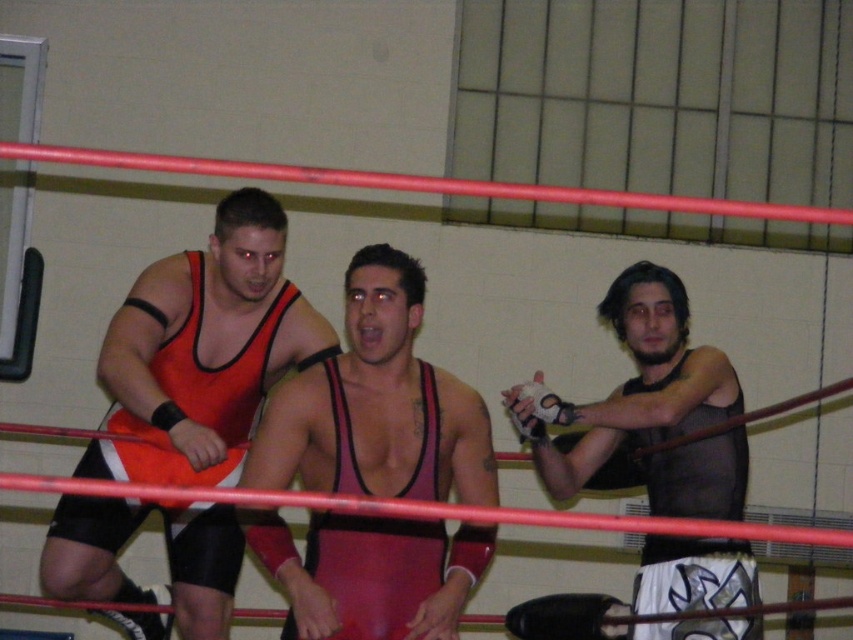
Based on the scene description, which wrestler is closer to the viewer? Please consider the positions of the shiny red singlet at center and the black mesh tank top at right.

The shiny red singlet at center is closer to the viewer as it is positioned in front of the black mesh tank top at right.

Based on the scene description, where is the matte orange singlet at center located in terms of its 2D coordinates?

The matte orange singlet at center is located at the 2D coordinates of point (202, 349).

You are a referee in a wrestling match and need to ensure the wrestlers are within the safety zone. The safety zone requires that wrestlers must be at least 20 inches apart. Are the matte orange singlet at center and the shiny red singlet at center within the safety zone?

The distance between the matte orange singlet at center and the shiny red singlet at center is 19.62 inches, which is less than the required 20 inches. Therefore, they are not within the safety zone.